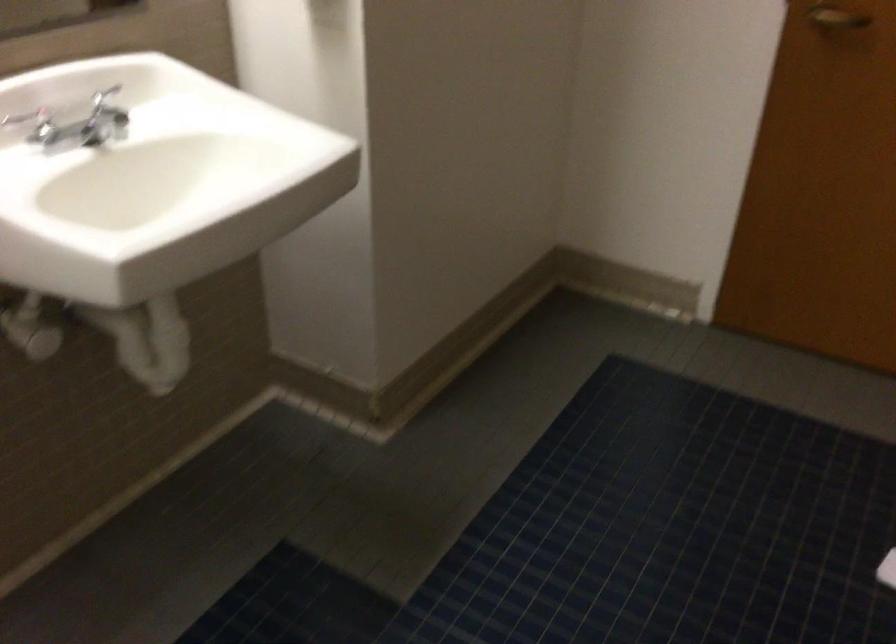
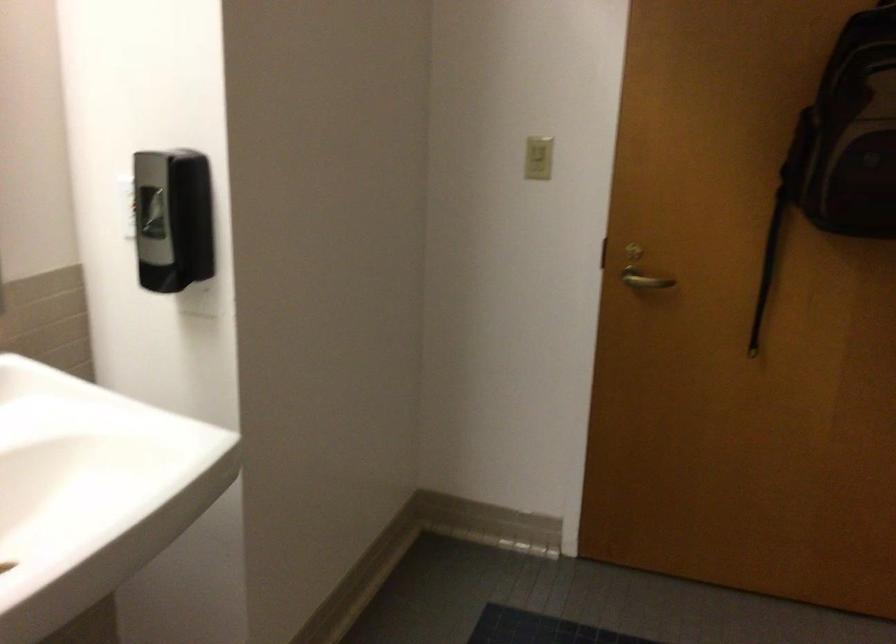
Question: The images are taken continuously from a first-person perspective. In which direction are you moving?

Choices:
 (A) Left
 (B) Right
 (C) Forward
 (D) Backward

Answer: (A)